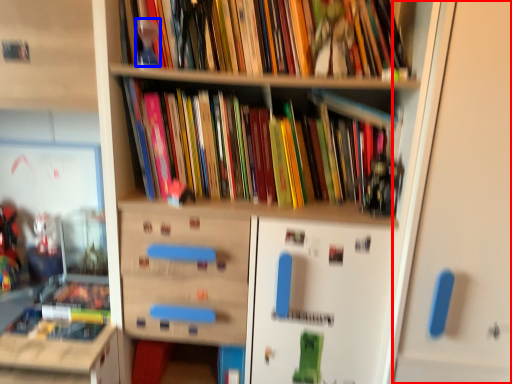
Question: Which object appears closest to the camera in this image, door (highlighted by a red box) or toy (highlighted by a blue box)?

Choices:
 (A) door
 (B) toy

Answer: (A)